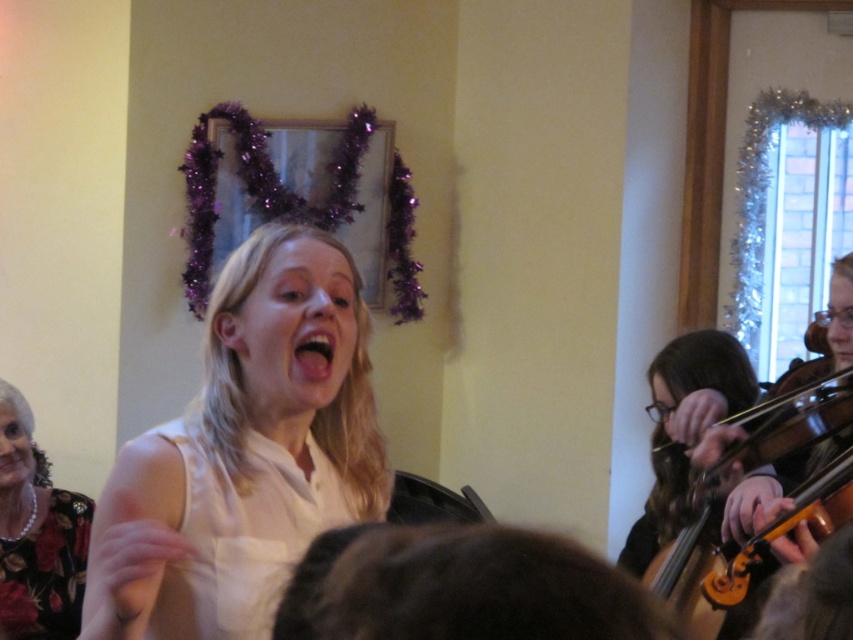
Based on the photo, does white satin dress at center have a greater width compared to black floral dress at lower left?

Yes, white satin dress at center is wider than black floral dress at lower left.

Does white satin dress at center have a greater height compared to black floral dress at lower left?

No.

Who is more distant from viewer, (x=248, y=500) or (x=61, y=588)?

The point (x=61, y=588) is more distant.

Where is `white satin dress at center`? This screenshot has height=640, width=853. white satin dress at center is located at coordinates (242, 531).

Is point (277, 518) less distant than point (712, 636)?

Yes, it is in front of point (712, 636).

Does point (186, 595) lie in front of point (822, 380)?

Yes, point (186, 595) is closer to viewer.

Identify the location of white matte shirt at center. The height and width of the screenshot is (640, 853). (244, 452).

Which is above, wooden violin at right or black floral dress at lower left?

wooden violin at right is above.

Does point (665, 570) come in front of point (64, 516)?

Yes, point (665, 570) is closer to viewer.

What are the coordinates of `wooden violin at right` in the screenshot? It's located at (721, 502).

This screenshot has width=853, height=640. I want to click on wooden violin at right, so click(721, 502).